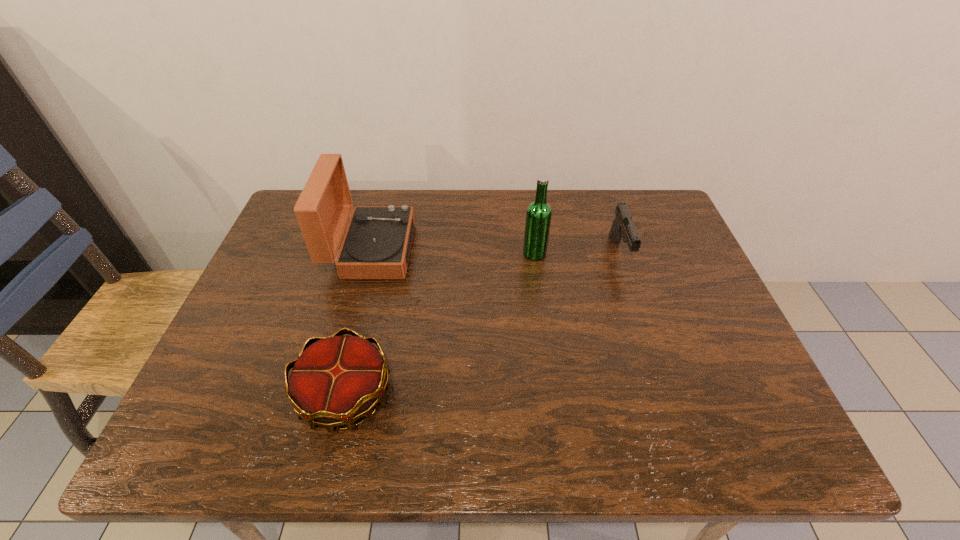
Locate an element on the screen. This screenshot has width=960, height=540. pistol present at the far edge is located at coordinates (623, 227).

At what (x,y) coordinates should I click in order to perform the action: click on object present at the near edge. Please return your answer as a coordinate pair (x, y). The image size is (960, 540). Looking at the image, I should click on (335, 380).

Locate an element on the screen. This screenshot has height=540, width=960. free space at the far edge of the desktop is located at coordinates (429, 195).

Locate an element on the screen. This screenshot has width=960, height=540. vacant space at the near edge is located at coordinates (512, 431).

Identify the location of vacant point at the left edge. (260, 373).

Identify the location of free space at the right edge of the desktop. (700, 362).

Image resolution: width=960 pixels, height=540 pixels. What are the coordinates of `free space at the near right corner of the desktop` in the screenshot? It's located at (712, 445).

You are a GUI agent. You are given a task and a screenshot of the screen. Output one action in this format:
    pyautogui.click(x=<x>, y=<y>)
    Task: Click on the free area in between the phonograph record and the pistol
    
    Given the screenshot: What is the action you would take?
    pyautogui.click(x=495, y=252)

This screenshot has width=960, height=540. In order to click on vacant area that lies between the phonograph record and the shortest object in this screenshot , I will do `click(358, 323)`.

Identify the location of vacant area that lies between the pistol and the phonograph record. The image size is (960, 540). (495, 252).